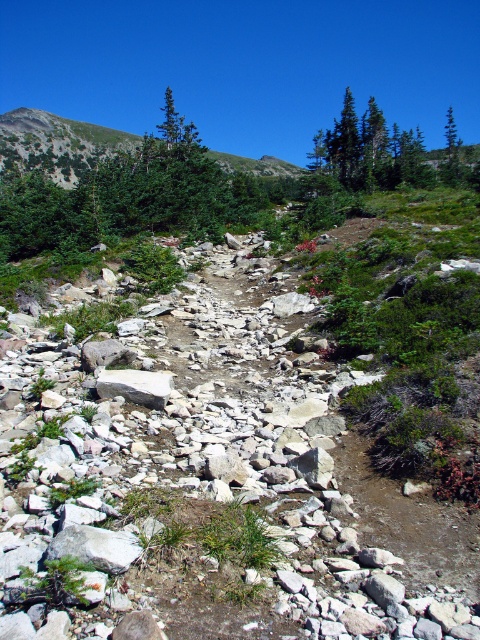
Which is below, green matte tree at upper center or gray/rough rock at center?

gray/rough rock at center is below.

From the picture: Can you confirm if green matte tree at upper center is positioned to the right of gray/rough rock at center?

Yes, green matte tree at upper center is to the right of gray/rough rock at center.

Does point (357, 129) come farther from viewer compared to point (117, 387)?

Yes, point (357, 129) is behind point (117, 387).

Locate an element on the screen. Image resolution: width=480 pixels, height=640 pixels. green matte tree at upper center is located at coordinates 370,150.